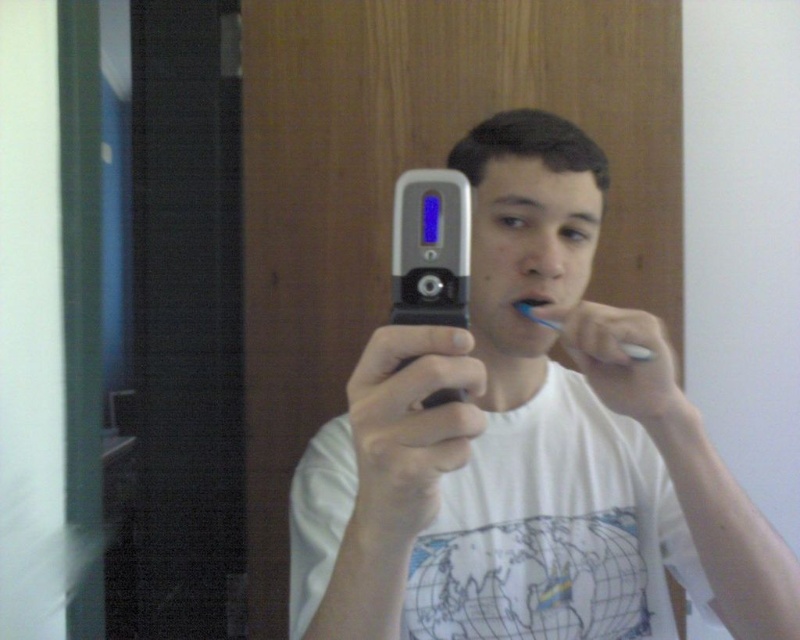
Question: Based on their relative distances, which object is farther from the silver metallic phone at center?

Choices:
 (A) silver metallic flip phone at center
 (B) matte plastic toothbrush at center

Answer: (A)

Question: Is blue plastic toothbrush at upper center further to camera compared to matte plastic toothbrush at center?

Choices:
 (A) yes
 (B) no

Answer: (B)

Question: Which object appears farthest from the camera in this image?

Choices:
 (A) blue plastic toothbrush at upper center
 (B) silver metallic flip phone at center

Answer: (A)

Question: Is silver metallic phone at center bigger than blue plastic toothbrush at upper center?

Choices:
 (A) yes
 (B) no

Answer: (A)

Question: Which of the following is the closest to the observer?

Choices:
 (A) (533, 301)
 (B) (678, 554)
 (C) (533, 321)
 (D) (416, 314)

Answer: (D)

Question: Is silver metallic flip phone at center smaller than matte plastic toothbrush at center?

Choices:
 (A) yes
 (B) no

Answer: (B)